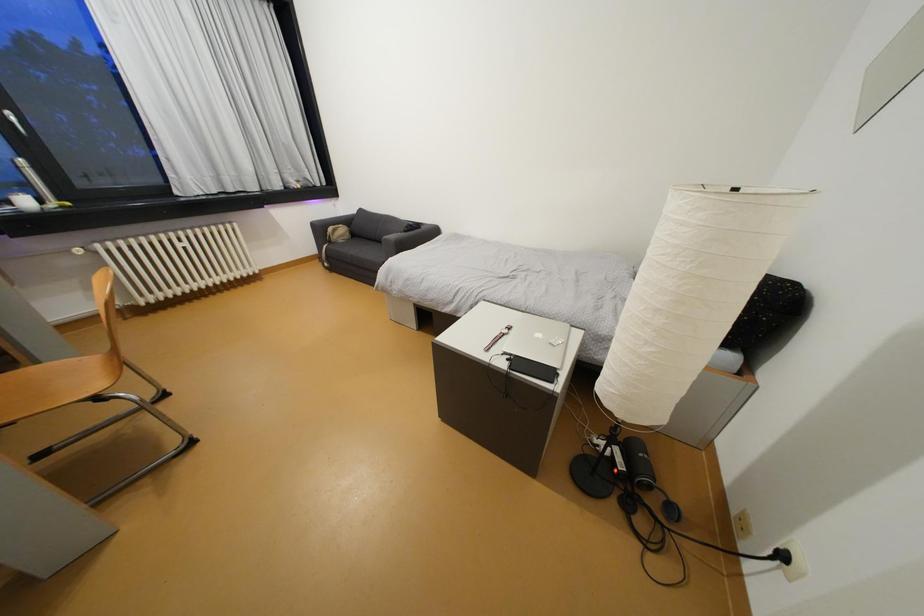
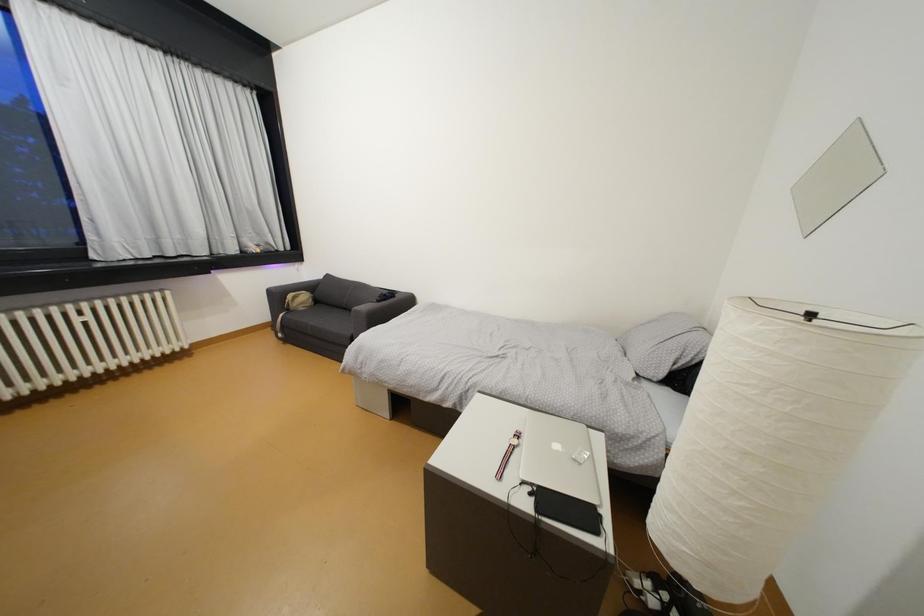
In a continuous first-person perspective shot, in which direction is the camera moving?

The cameraman walked toward left, forward.